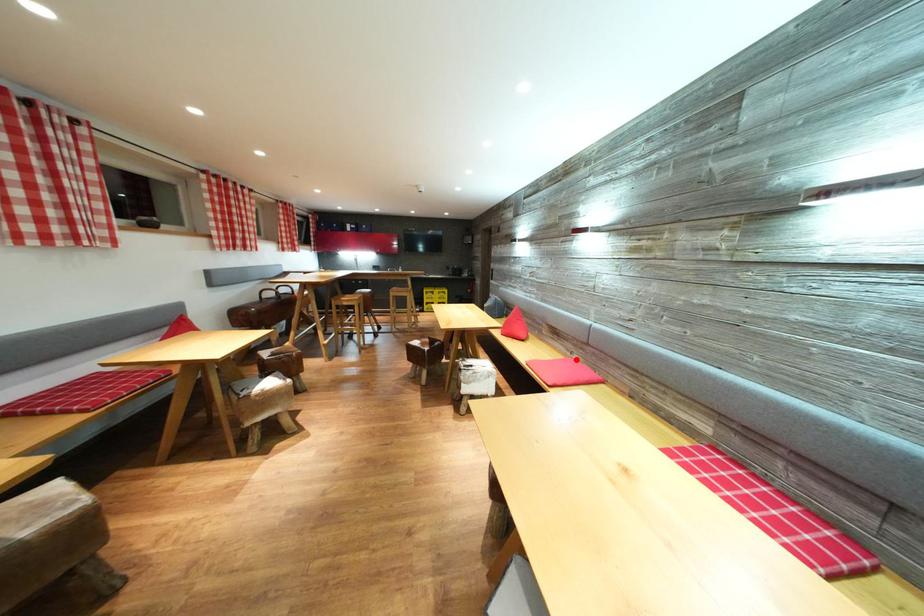
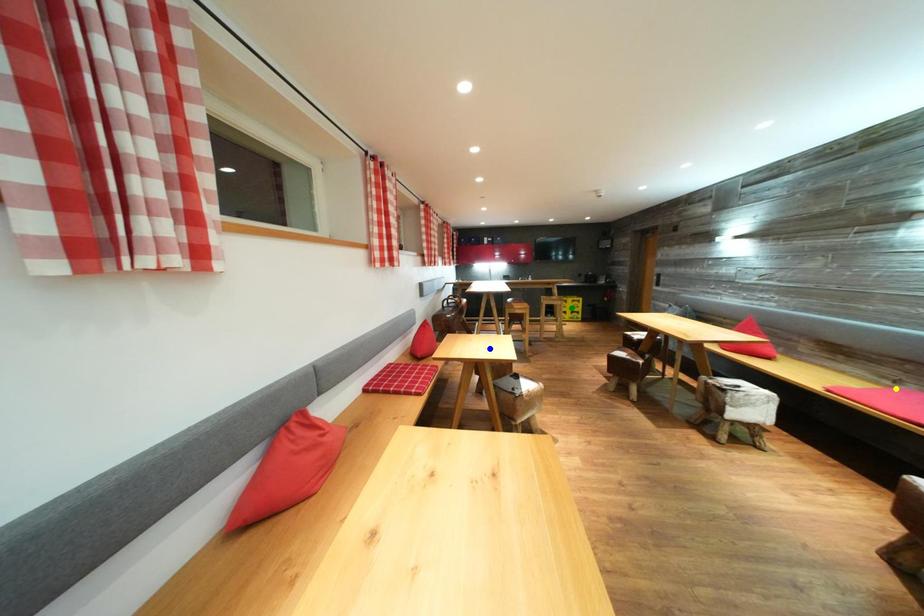
Question: I am providing you with two images of the same scene from different viewpoints. A red point is marked on the first image. You are given multiple points on the second image. Which point in image 2 represents the same 3d spot as the red point in image 1?

Choices:
 (A) yellow point
 (B) green point
 (C) blue point

Answer: (A)